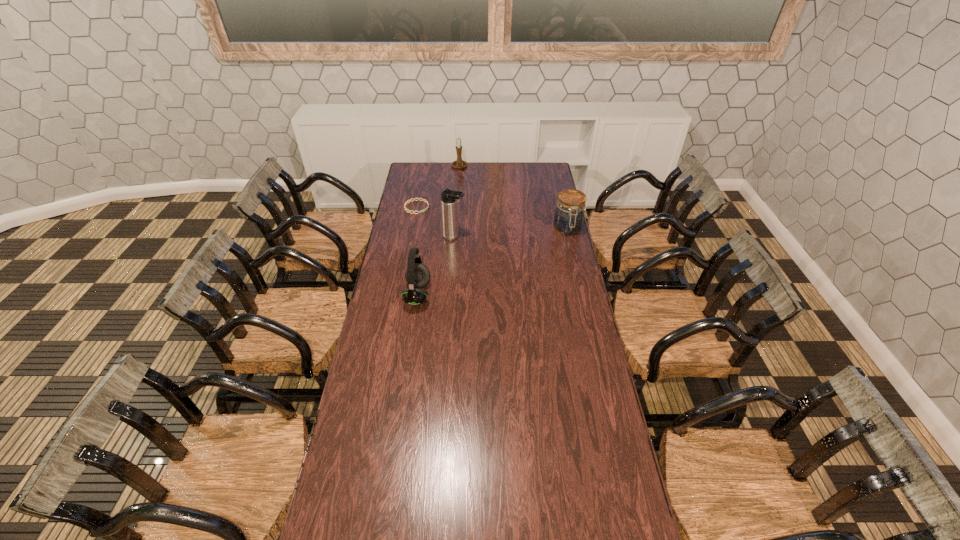
Where is `vacant space situated on the handle side of the tallest object`? The width and height of the screenshot is (960, 540). vacant space situated on the handle side of the tallest object is located at coordinates (472, 243).

Locate an element on the screen. This screenshot has width=960, height=540. free region located on the side of the farthest object with the handle is located at coordinates (465, 191).

Image resolution: width=960 pixels, height=540 pixels. Find the location of `vacant position located on the side of the farthest object with the handle`. vacant position located on the side of the farthest object with the handle is located at coordinates (464, 186).

This screenshot has height=540, width=960. Identify the location of vacant region located 0.150m on the side of the farthest object with the handle. (464, 185).

Locate an element on the screen. The image size is (960, 540). vacant space located on the surface of the bracelet showing star-shaped elements is located at coordinates (469, 230).

What are the coordinates of `vacant space situated on the surface of the bracelet showing star-shaped elements` in the screenshot? It's located at (435, 215).

Find the location of a particular element. vacant space located on the surface of the bracelet showing star-shaped elements is located at coordinates pyautogui.click(x=479, y=233).

Where is `object located in the far edge section of the desktop`? The width and height of the screenshot is (960, 540). object located in the far edge section of the desktop is located at coordinates (459, 163).

Image resolution: width=960 pixels, height=540 pixels. In order to click on headset that is at the left edge in this screenshot , I will do `click(417, 275)`.

Where is `bracelet positioned at the left edge`? bracelet positioned at the left edge is located at coordinates (405, 204).